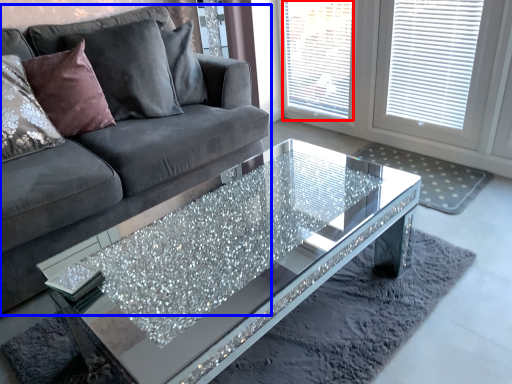
Question: Among these objects, which one is farthest to the camera, window screen (highlighted by a red box) or studio couch (highlighted by a blue box)?

Choices:
 (A) window screen
 (B) studio couch

Answer: (A)